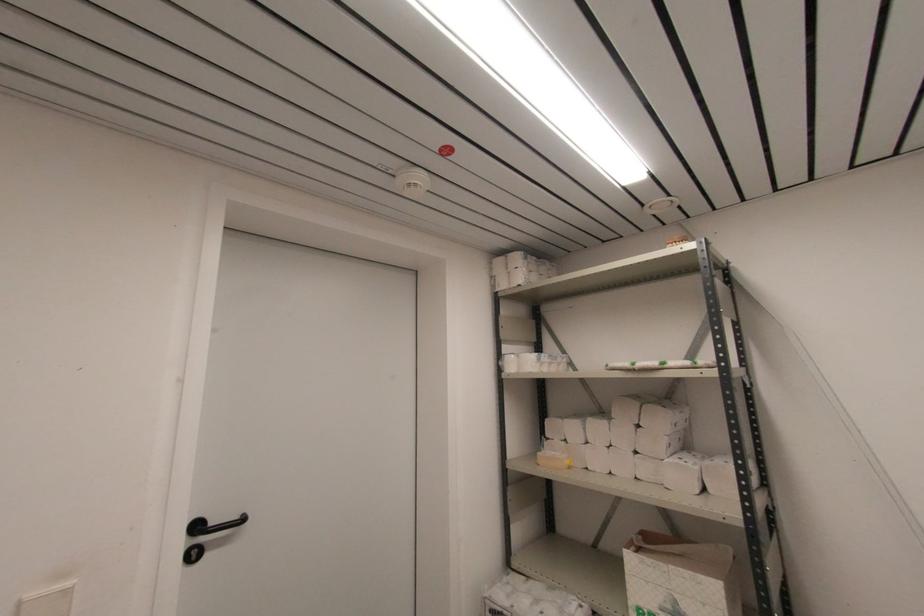
At what (x,y) coordinates should I click in order to perform the action: click on black door handle. Please return your answer as a coordinate pair (x, y). The width and height of the screenshot is (924, 616). Looking at the image, I should click on (207, 535).